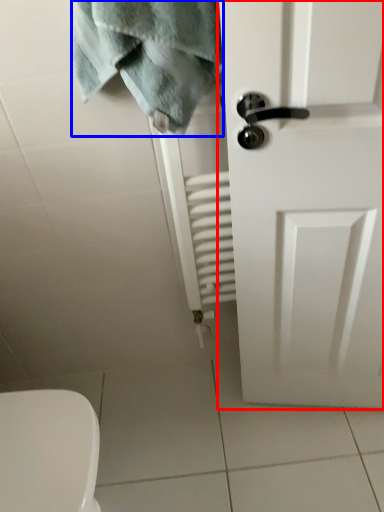
Question: Which point is closer to the camera, door (highlighted by a red box) or bath towel (highlighted by a blue box)?

Choices:
 (A) door
 (B) bath towel

Answer: (A)